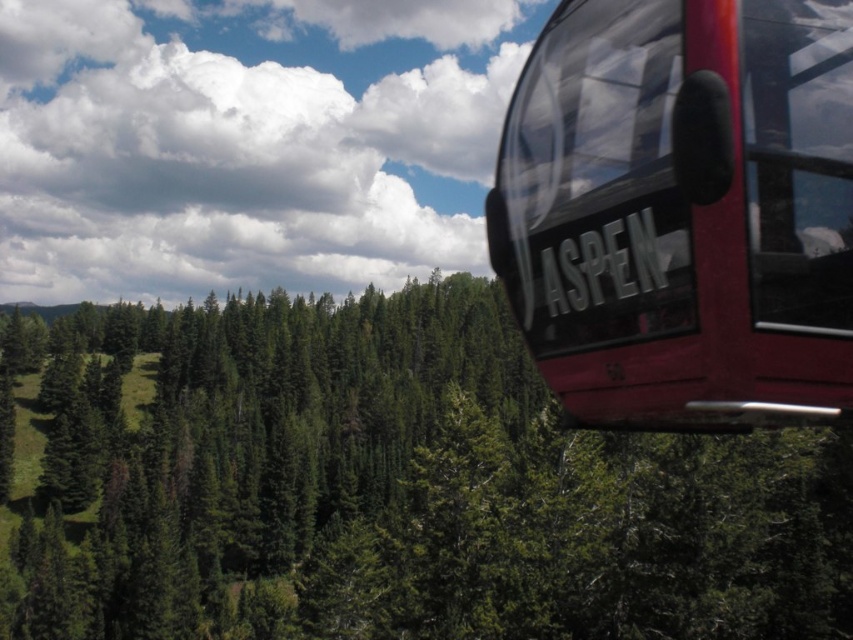
Question: Does green matte tree at upper center appear under shiny red cable car at upper right?

Choices:
 (A) yes
 (B) no

Answer: (A)

Question: Among these objects, which one is farthest from the camera?

Choices:
 (A) shiny red cable car at upper right
 (B) green matte tree at upper center

Answer: (B)

Question: Which object appears closest to the camera in this image?

Choices:
 (A) green matte tree at upper center
 (B) shiny red cable car at upper right

Answer: (B)

Question: Observing the image, what is the correct spatial positioning of green matte tree at upper center in reference to shiny red cable car at upper right?

Choices:
 (A) left
 (B) right

Answer: (A)

Question: Does green matte tree at upper center have a smaller size compared to shiny red cable car at upper right?

Choices:
 (A) yes
 (B) no

Answer: (B)